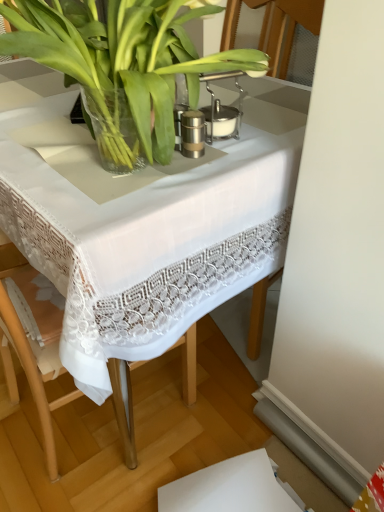
Question: Is green leafy plant at center positioned far away from white lace tablecloth at center?

Choices:
 (A) yes
 (B) no

Answer: (B)

Question: Is green leafy plant at center oriented towards white lace tablecloth at center?

Choices:
 (A) no
 (B) yes

Answer: (A)

Question: From a real-world perspective, is green leafy plant at center positioned under white lace tablecloth at center based on gravity?

Choices:
 (A) yes
 (B) no

Answer: (B)

Question: Is green leafy plant at center outside of white lace tablecloth at center?

Choices:
 (A) no
 (B) yes

Answer: (B)

Question: Does green leafy plant at center have a lesser height compared to white lace tablecloth at center?

Choices:
 (A) no
 (B) yes

Answer: (B)

Question: Is green leafy plant at center in contact with white lace tablecloth at center?

Choices:
 (A) no
 (B) yes

Answer: (A)

Question: Does white lace tablecloth at center turn towards green leafy plant at center?

Choices:
 (A) no
 (B) yes

Answer: (A)

Question: Is white lace tablecloth at center positioned before green leafy plant at center?

Choices:
 (A) yes
 (B) no

Answer: (B)

Question: From the image's perspective, is white lace tablecloth at center on top of green leafy plant at center?

Choices:
 (A) no
 (B) yes

Answer: (A)

Question: Considering the relative positions of white lace tablecloth at center and green leafy plant at center in the image provided, is white lace tablecloth at center to the right of green leafy plant at center from the viewer's perspective?

Choices:
 (A) no
 (B) yes

Answer: (A)

Question: Is white lace tablecloth at center bigger than green leafy plant at center?

Choices:
 (A) no
 (B) yes

Answer: (B)

Question: From a real-world perspective, is white lace tablecloth at center located higher than green leafy plant at center?

Choices:
 (A) yes
 (B) no

Answer: (B)

Question: Choose the correct answer: Is white lace tablecloth at center inside green leafy plant at center or outside it?

Choices:
 (A) outside
 (B) inside

Answer: (A)